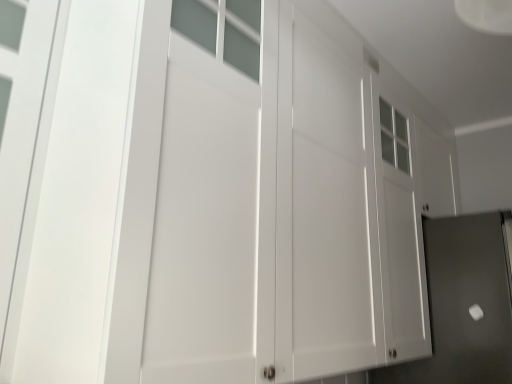
Question: Should I look upward or downward to see white glossy screen door at right?

Choices:
 (A) up
 (B) down

Answer: (B)